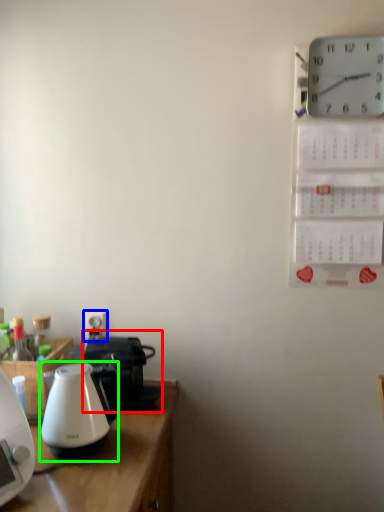
Question: Which object is positioned farthest from coffeepot (highlighted by a red box)? Select from electric outlet (highlighted by a blue box) and kettle (highlighted by a green box).

Choices:
 (A) electric outlet
 (B) kettle

Answer: (A)